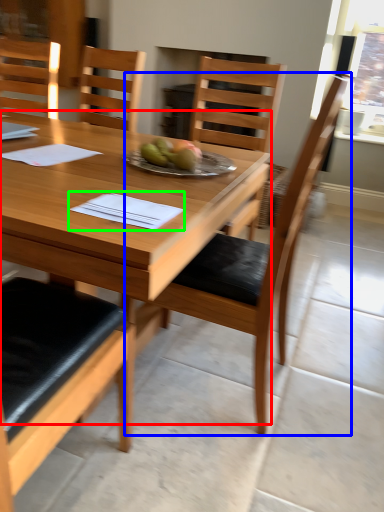
Question: Which is nearer to the desk (highlighted by a red box)? chair (highlighted by a blue box) or notebook (highlighted by a green box).

Choices:
 (A) chair
 (B) notebook

Answer: (B)